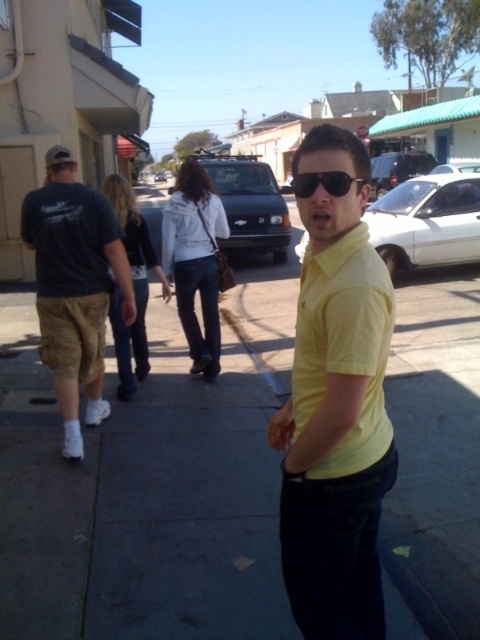
You are a delivery drone operator. Your drone is currently hovering above the gray concrete sidewalk at center and sunglasses at center. Which object is taller? Please answer based on their heights in the image.

The sunglasses at center are taller than the gray concrete sidewalk at center according to the description.

What are the coordinates of the gray concrete sidewalk at center?

The gray concrete sidewalk at center is located at coordinates point (x=149, y=483).